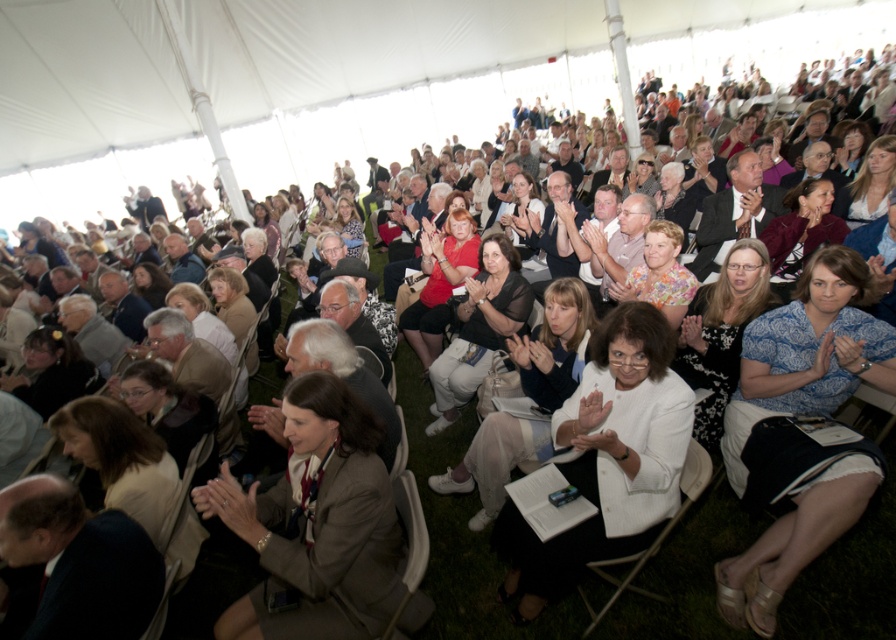
Who is more distant from viewer, (651,275) or (634,266)?

The point (634,266) is behind.

Which is more to the right, floral fabric dress at center or light brown leather jacket at center?

Positioned to the right is floral fabric dress at center.

Where is `floral fabric dress at center`? floral fabric dress at center is located at coordinates (660, 273).

You are a GUI agent. You are given a task and a screenshot of the screen. Output one action in this format:
    pyautogui.click(x=<x>, y=<y>)
    Task: Click on the floral fabric dress at center
    The image size is (896, 640).
    Given the screenshot: What is the action you would take?
    pyautogui.click(x=660, y=273)

Does matte red shirt at center appear on the left side of floral fabric dress at center?

Indeed, matte red shirt at center is positioned on the left side of floral fabric dress at center.

Can you confirm if matte red shirt at center is positioned to the right of floral fabric dress at center?

Incorrect, matte red shirt at center is not on the right side of floral fabric dress at center.

Between point (440, 342) and point (669, 253), which one is positioned behind?

Positioned behind is point (440, 342).

You are a GUI agent. You are given a task and a screenshot of the screen. Output one action in this format:
    pyautogui.click(x=<x>, y=<y>)
    Task: Click on the matte red shirt at center
    The height and width of the screenshot is (640, 896).
    Given the screenshot: What is the action you would take?
    pyautogui.click(x=438, y=282)

Can you confirm if blue printed blouse at center is positioned above white fabric jacket at center?

Yes.

Looking at this image, between blue printed blouse at center and white fabric jacket at center, which one has more height?

With more height is blue printed blouse at center.

Measure the distance between blue printed blouse at center and camera.

A distance of 2.15 meters exists between blue printed blouse at center and camera.

At what (x,y) coordinates should I click in order to perform the action: click on blue printed blouse at center. Please return your answer as a coordinate pair (x, y). Looking at the image, I should click on (807, 355).